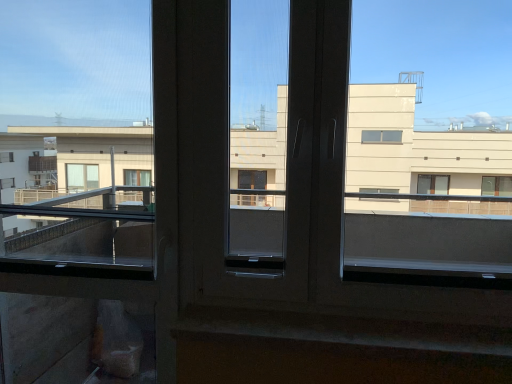
Based on the photo, what is the approximate width of transparent glass window at left?

It is 4.64 inches.

What do you see at coordinates (76, 137) in the screenshot? Image resolution: width=512 pixels, height=384 pixels. I see `transparent glass window at left` at bounding box center [76, 137].

The image size is (512, 384). Find the location of `transparent glass window at left`. transparent glass window at left is located at coordinates (76, 137).

The height and width of the screenshot is (384, 512). Find the location of `transparent glass window at left`. transparent glass window at left is located at coordinates (76, 137).